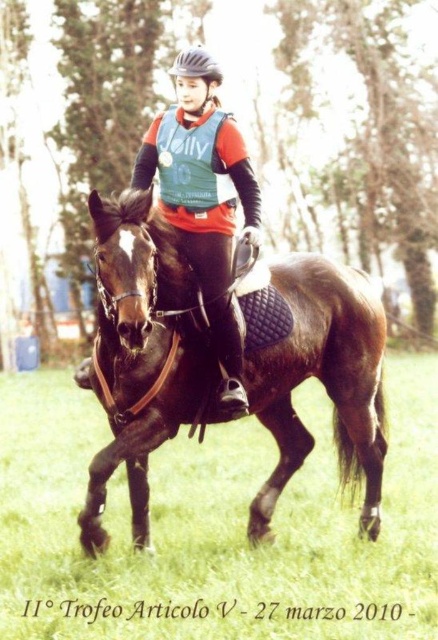
Question: Among these points, which one is nearest to the camera?

Choices:
 (A) (64, 525)
 (B) (175, 67)

Answer: (B)

Question: Can you confirm if green grass at center is positioned below brown glossy horse at center?

Choices:
 (A) yes
 (B) no

Answer: (A)

Question: Among these objects, which one is farthest from the camera?

Choices:
 (A) black matte helmet at upper center
 (B) green grass at center

Answer: (A)

Question: Is green grass at center below black matte helmet at upper center?

Choices:
 (A) yes
 (B) no

Answer: (A)

Question: Is green grass at center to the right of black matte helmet at upper center from the viewer's perspective?

Choices:
 (A) yes
 (B) no

Answer: (B)

Question: Which of the following is the closest to the observer?

Choices:
 (A) (296, 417)
 (B) (421, 356)
 (C) (184, 51)

Answer: (C)